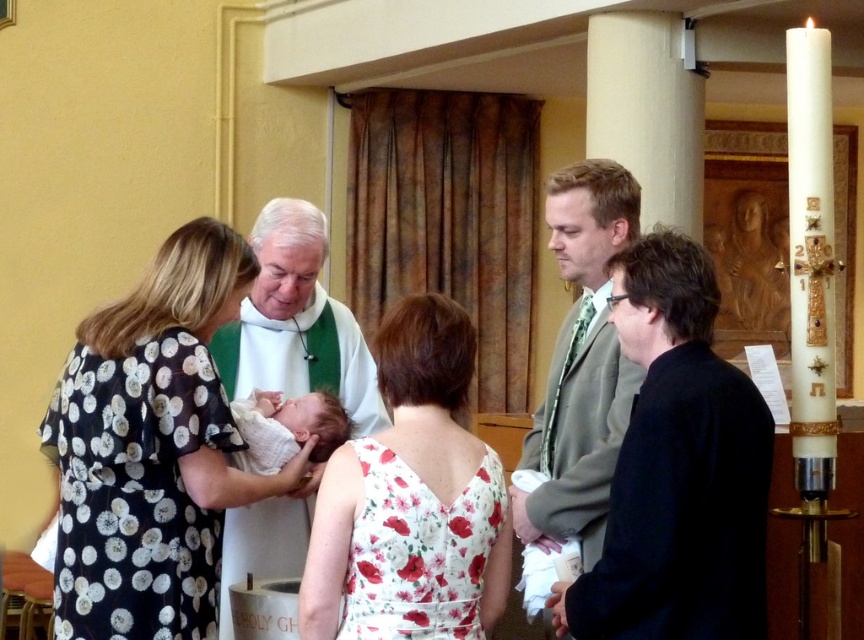
Question: Which object appears closest to the camera in this image?

Choices:
 (A) green textured tie at center
 (B) floral fabric dress at center

Answer: (B)

Question: Does floral fabric dress at center have a larger size compared to white floral dress at center?

Choices:
 (A) no
 (B) yes

Answer: (A)

Question: Which point is farther to the camera?

Choices:
 (A) (256, 420)
 (B) (500, 492)
 (C) (548, 396)
 (D) (77, 406)

Answer: (C)

Question: Is floral fabric dress at center wider than green textured tie at center?

Choices:
 (A) no
 (B) yes

Answer: (B)

Question: Which point is closer to the camera?

Choices:
 (A) white soft cloth at center
 (B) white floral dress at center
 (C) green textured tie at center

Answer: (B)

Question: Is green textured tie at center smaller than white soft cloth at center?

Choices:
 (A) no
 (B) yes

Answer: (A)